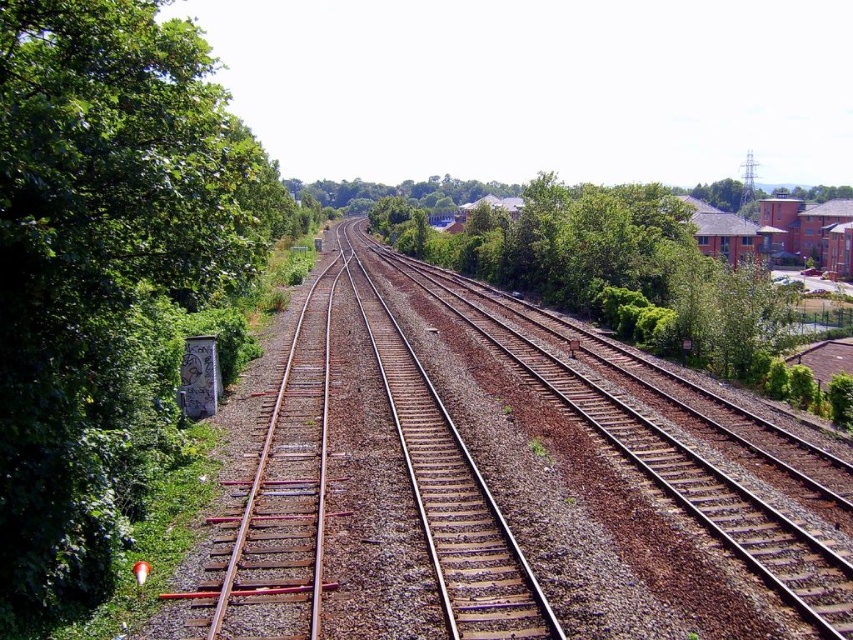
You are standing at the point with coordinates (482, 483) in the railway track scene. What object is located exactly at that point?

The point (482, 483) corresponds to the brown gravel track at center.

You are standing at the origin point of the image coordinate system. Where is the brown gravel track at center located in terms of 2D coordinates?

The brown gravel track at center is located at the 2D coordinates of point [482,483].

You are standing on the brown gravel track at center and looking towards the green leafy tree at left. Which direction should you walk to get closer to the tree?

The brown gravel track at center is positioned under the green leafy tree at left, so you should walk towards the left to get closer to the tree.